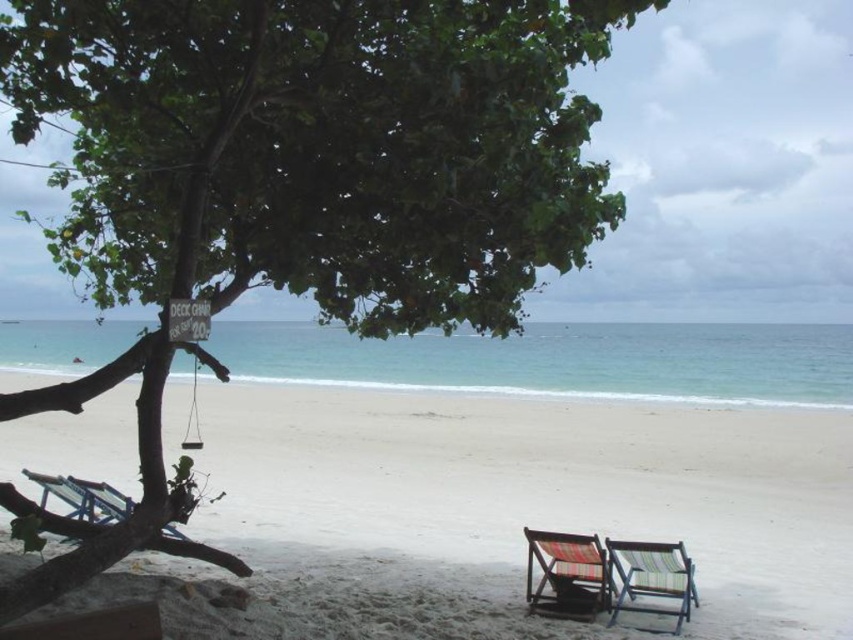
Question: Is striped fabric beach chair at lower right thinner than wooden deck chair at left?

Choices:
 (A) yes
 (B) no

Answer: (A)

Question: Which object appears farthest from the camera in this image?

Choices:
 (A) wooden deck chair at left
 (B) white sandy beach at center
 (C) plaid fabric beach chair at lower right

Answer: (A)

Question: Which is farther from the plaid fabric beach chair at lower right?

Choices:
 (A) wooden deck chair at left
 (B) striped fabric beach chair at lower right

Answer: (A)

Question: Where is striped fabric beach chair at lower right located in relation to wooden deck chair at left in the image?

Choices:
 (A) right
 (B) left

Answer: (A)

Question: Can you confirm if striped fabric beach chair at lower right is positioned above wooden deck chair at left?

Choices:
 (A) no
 (B) yes

Answer: (A)

Question: Estimate the real-world distances between objects in this image. Which object is closer to the white sandy beach at center?

Choices:
 (A) striped fabric beach chair at lower right
 (B) plaid fabric beach chair at lower right
 (C) wooden deck chair at left

Answer: (B)